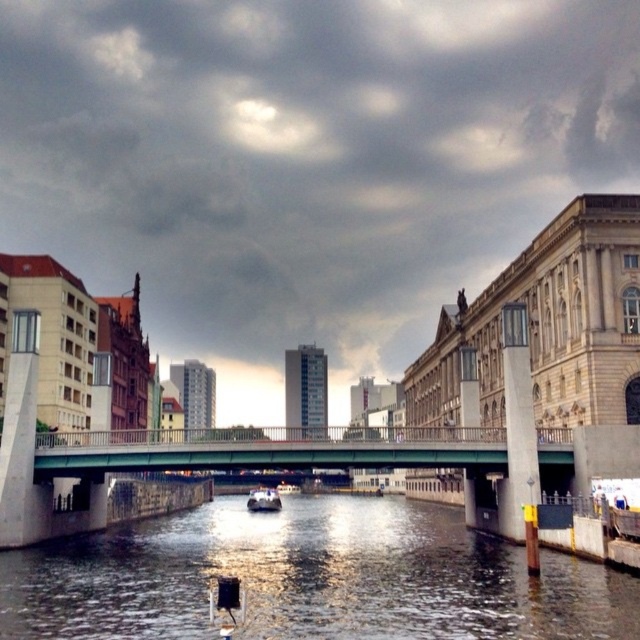
Can you confirm if green metallic bridge at center is shorter than white glossy boat at center?

Correct, green metallic bridge at center is not as tall as white glossy boat at center.

Between point (164, 461) and point (276, 504), which one is positioned in front?

Positioned in front is point (164, 461).

Find the location of `green metallic bridge at center`. green metallic bridge at center is located at coordinates (282, 461).

Between shiny dark water at center and white glossy boat at center, which one has less height?

shiny dark water at center

Between shiny dark water at center and white glossy boat at center, which one is positioned higher?

shiny dark water at center is higher up.

Which is behind, point (253, 630) or point (253, 499)?

Positioned behind is point (253, 499).

Find the location of `shiny dark water at center`. shiny dark water at center is located at coordinates (310, 579).

Is point (420, 570) less distant than point (136, 445)?

Yes, point (420, 570) is in front of point (136, 445).

From the picture: Which is more to the right, shiny dark water at center or green metallic bridge at center?

Positioned to the right is green metallic bridge at center.

What do you see at coordinates (310, 579) in the screenshot? The width and height of the screenshot is (640, 640). I see `shiny dark water at center` at bounding box center [310, 579].

Where is `shiny dark water at center`? The image size is (640, 640). shiny dark water at center is located at coordinates (310, 579).